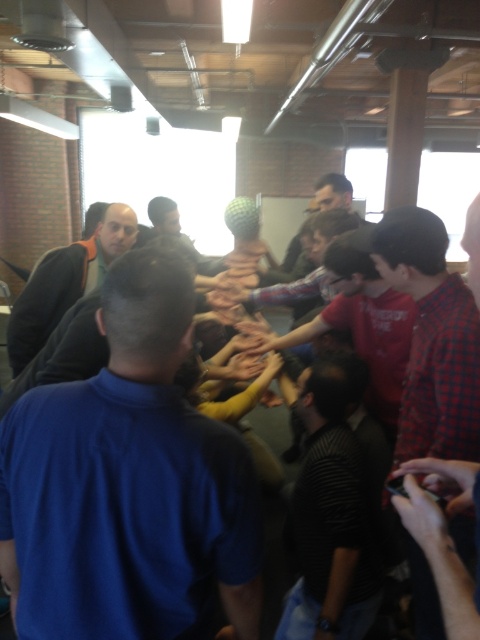
Question: Which is nearer to the dark gray sweater at left?

Choices:
 (A) dark striped shirt at center
 (B) camouflage fabric shirt at center

Answer: (B)

Question: Which point is farther to the camera?

Choices:
 (A) dark striped shirt at center
 (B) blue fabric shirt at center
 (C) camouflage fabric shirt at center

Answer: (C)

Question: Is dark gray sweater at left bigger than camouflage fabric shirt at center?

Choices:
 (A) yes
 (B) no

Answer: (A)

Question: Can you confirm if dark gray sweater at left is bigger than camouflage fabric shirt at center?

Choices:
 (A) no
 (B) yes

Answer: (B)

Question: Which point is farther to the camera?

Choices:
 (A) camouflage fabric shirt at center
 (B) dark gray sweater at left

Answer: (A)

Question: Is dark striped shirt at center above dark gray sweater at left?

Choices:
 (A) no
 (B) yes

Answer: (A)